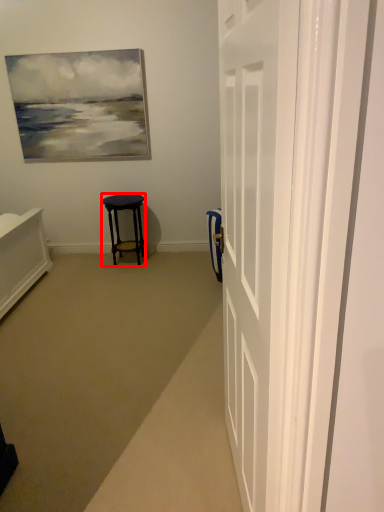
Question: From the image, what is the correct spatial relationship of stool (annotated by the red box) in relation to door?

Choices:
 (A) right
 (B) left

Answer: (B)